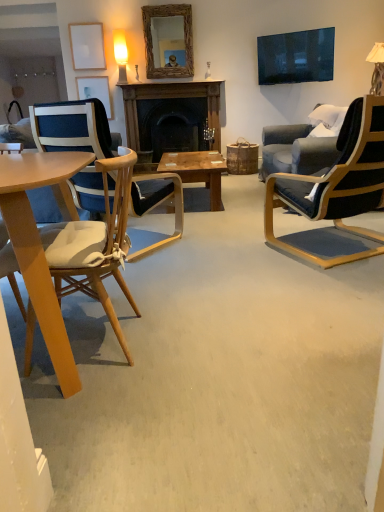
Question: Is woven wood mirror at upper center positioned far away from matte white picture frame at upper left, acting as the 1th picture frame starting from the bottom?

Choices:
 (A) no
 (B) yes

Answer: (A)

Question: Considering the relative positions of woven wood mirror at upper center and matte white picture frame at upper left, the second picture frame viewed from the top, in the image provided, is woven wood mirror at upper center behind matte white picture frame at upper left, the second picture frame viewed from the top,?

Choices:
 (A) yes
 (B) no

Answer: (B)

Question: Is woven wood mirror at upper center to the right of matte white picture frame at upper left, the first picture frame in the back-to-front sequence, from the viewer's perspective?

Choices:
 (A) yes
 (B) no

Answer: (A)

Question: From the image's perspective, does woven wood mirror at upper center appear lower than matte white picture frame at upper left, the first picture frame in the back-to-front sequence?

Choices:
 (A) yes
 (B) no

Answer: (B)

Question: Does woven wood mirror at upper center have a greater height compared to matte white picture frame at upper left, the first picture frame in the back-to-front sequence?

Choices:
 (A) no
 (B) yes

Answer: (B)

Question: Is woven wood mirror at upper center outside of matte white picture frame at upper left, the second picture frame viewed from the top?

Choices:
 (A) yes
 (B) no

Answer: (A)

Question: From the image's perspective, is black leather chair at right, marked as the first chair in a right-to-left arrangement, located above dark wood fireplace at center?

Choices:
 (A) no
 (B) yes

Answer: (A)

Question: Does black leather chair at right, acting as the third chair starting from the left, have a lesser width compared to dark wood fireplace at center?

Choices:
 (A) yes
 (B) no

Answer: (B)

Question: Can dark wood fireplace at center be found inside black leather chair at right, marked as the first chair in a right-to-left arrangement?

Choices:
 (A) no
 (B) yes

Answer: (A)

Question: Does black leather chair at right, acting as the third chair starting from the left, lie in front of dark wood fireplace at center?

Choices:
 (A) yes
 (B) no

Answer: (A)

Question: From the image's perspective, does black leather chair at right, marked as the first chair in a right-to-left arrangement, appear lower than dark wood fireplace at center?

Choices:
 (A) no
 (B) yes

Answer: (B)

Question: Considering the relative sizes of black leather chair at right, marked as the first chair in a right-to-left arrangement, and dark wood fireplace at center in the image provided, is black leather chair at right, marked as the first chair in a right-to-left arrangement, smaller than dark wood fireplace at center?

Choices:
 (A) yes
 (B) no

Answer: (B)

Question: Can you confirm if dark wood fireplace at center is smaller than black leather chair at right, acting as the third chair starting from the left?

Choices:
 (A) yes
 (B) no

Answer: (A)